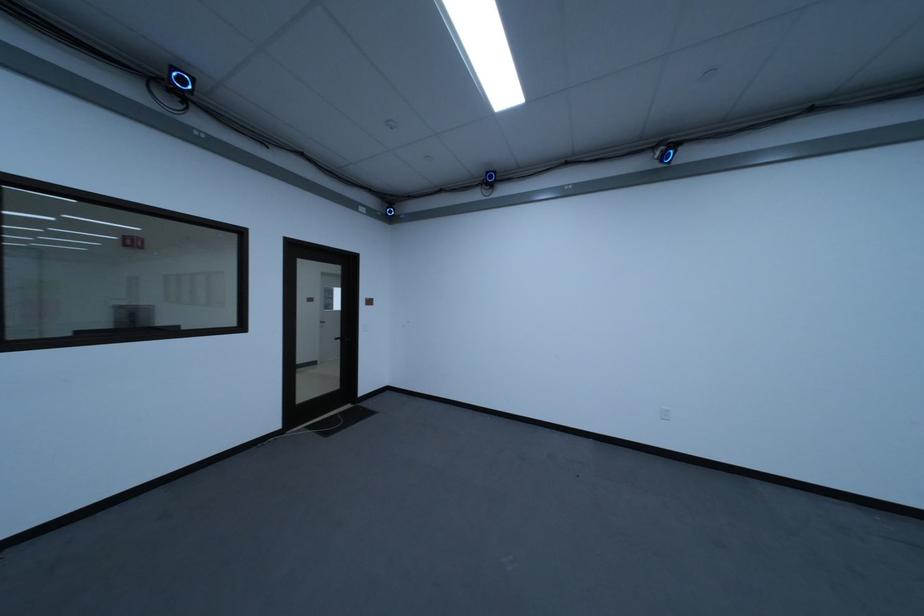
In order to click on white electrical outlet in this screenshot , I will do `click(664, 413)`.